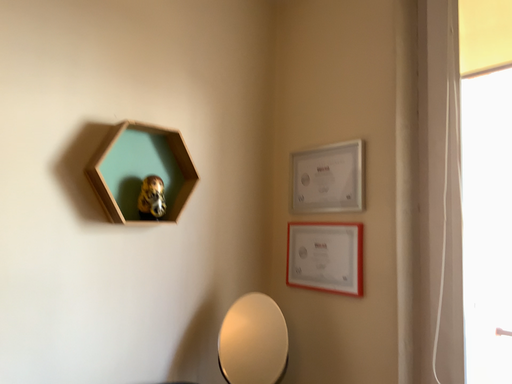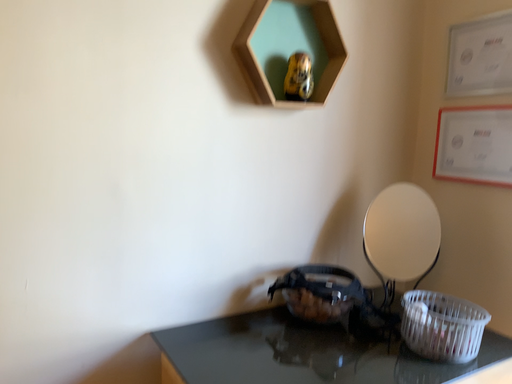
Question: How did the camera likely rotate when shooting the video?

Choices:
 (A) rotated right
 (B) rotated left

Answer: (B)